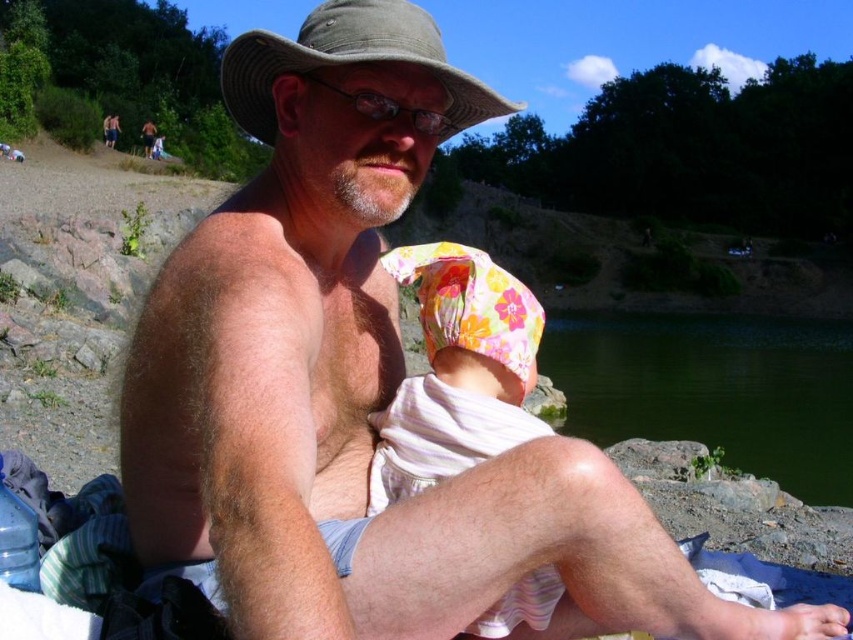
Does green water at lower center have a larger size compared to khaki fabric hat at upper center?

Correct, green water at lower center is larger in size than khaki fabric hat at upper center.

Which is more to the left, green water at lower center or khaki fabric hat at upper center?

From the viewer's perspective, khaki fabric hat at upper center appears more on the left side.

Is point (723, 339) positioned after point (415, 33)?

Yes, it is.

The height and width of the screenshot is (640, 853). I want to click on green water at lower center, so click(714, 388).

Does point (573, 360) lie behind point (448, 440)?

Yes, point (573, 360) is farther from viewer.

Is green water at lower center closer to camera compared to floral fabric baby at center?

No.

Image resolution: width=853 pixels, height=640 pixels. I want to click on green water at lower center, so click(x=714, y=388).

Between floral fabric baby at center and khaki fabric hat at upper center, which one has more height?

khaki fabric hat at upper center is taller.

Who is shorter, floral fabric baby at center or khaki fabric hat at upper center?

floral fabric baby at center

Where is `floral fabric baby at center`? floral fabric baby at center is located at coordinates (457, 371).

Where is `floral fabric baby at center`? The image size is (853, 640). floral fabric baby at center is located at coordinates [x=457, y=371].